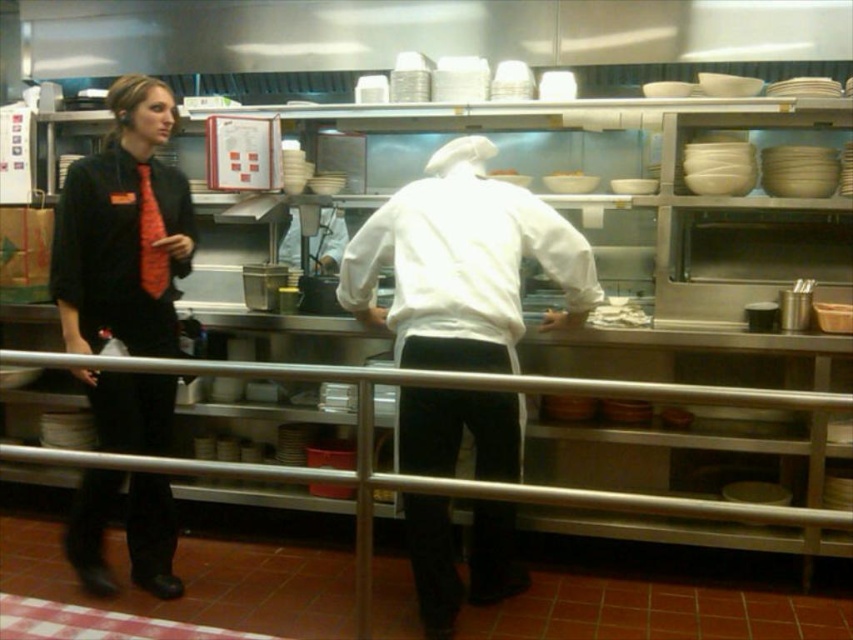
You are a new employee in the kitchen and need to hang your apron on the brushed metal rail at center. The white matte chef coat at center is currently in the way. Which direction should you move the coat to access the rail?

The white matte chef coat at center is positioned on the right side of the brushed metal rail at center. To access the rail, you should move the coat to the left.

From the picture: You are a customer trying to locate two points marked in the image. The first point is at coordinate point (396, 348) and the second at point (177, 214). Which of these points is closer to you as you look at the image?

The point at coordinate point (396, 348) is closer to you than point (177, 214).